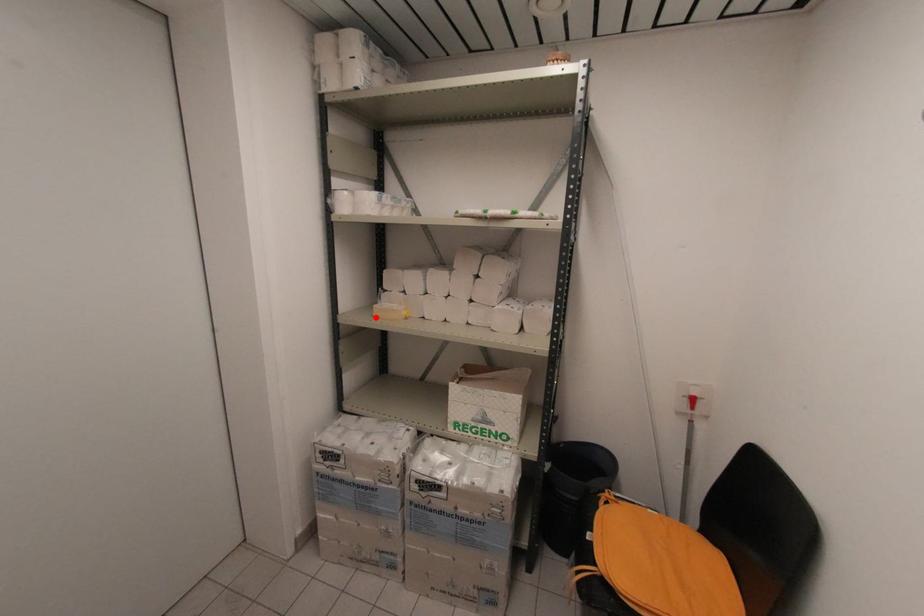
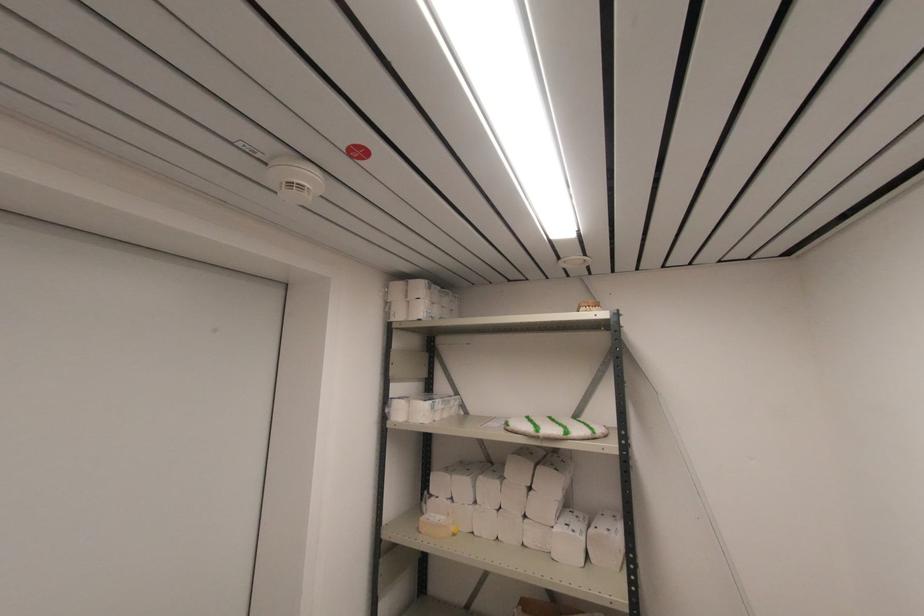
Locate, in the second image, the point that corresponds to the highlighted location in the first image.

(420, 533)